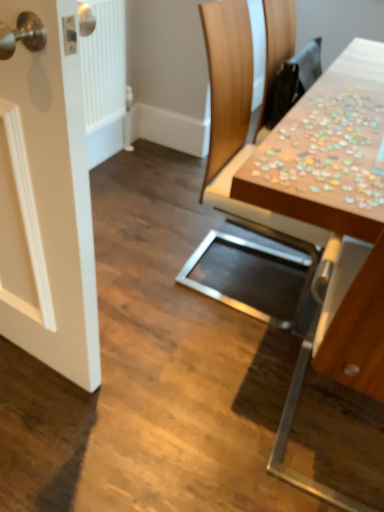
Where is `vacant region to the left of wooden puzzle pieces at upper right`? This screenshot has width=384, height=512. vacant region to the left of wooden puzzle pieces at upper right is located at coordinates (182, 399).